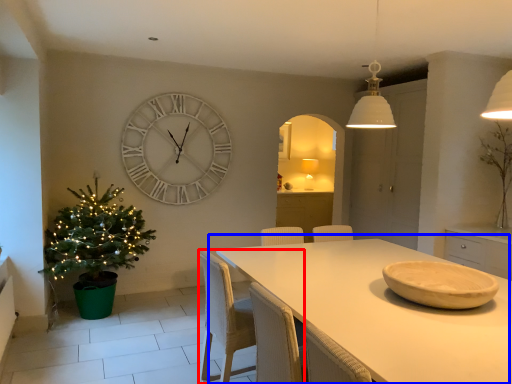
Question: Among these objects, which one is farthest to the camera, chair (highlighted by a red box) or table (highlighted by a blue box)?

Choices:
 (A) chair
 (B) table

Answer: (A)